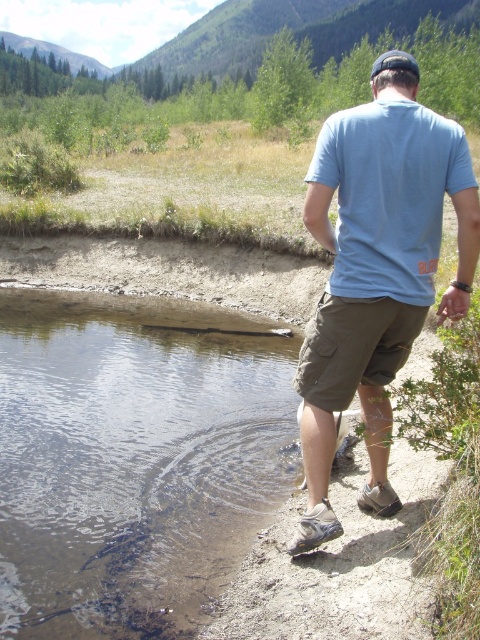
Which of these two, clear water at lower left or khaki cotton shorts at lower center, stands shorter?

Standing shorter between the two is clear water at lower left.

Measure the distance between point (248, 529) and camera.

Point (248, 529) and camera are 3.91 meters apart from each other.

Where is `clear water at lower left`? The height and width of the screenshot is (640, 480). clear water at lower left is located at coordinates (132, 460).

In the scene shown: Which is below, light blue cotton shirt at upper right or light blue cotton t-shirt at back?

light blue cotton shirt at upper right is below.

Who is positioned more to the left, light blue cotton shirt at upper right or light blue cotton t-shirt at back?

light blue cotton t-shirt at back is more to the left.

Who is more distant from viewer, (332, 291) or (403, 129)?

The point (332, 291) is more distant.

At what (x,y) coordinates should I click in order to perform the action: click on light blue cotton shirt at upper right. Please return your answer as a coordinate pair (x, y). Looking at the image, I should click on (376, 269).

Is light blue cotton shirt at upper right above khaki cotton shorts at lower center?

Yes, light blue cotton shirt at upper right is above khaki cotton shorts at lower center.

Which is more to the right, light blue cotton shirt at upper right or khaki cotton shorts at lower center?

Positioned to the right is light blue cotton shirt at upper right.

What do you see at coordinates (376, 269) in the screenshot?
I see `light blue cotton shirt at upper right` at bounding box center [376, 269].

What are the coordinates of `light blue cotton shirt at upper right` in the screenshot? It's located at (376, 269).